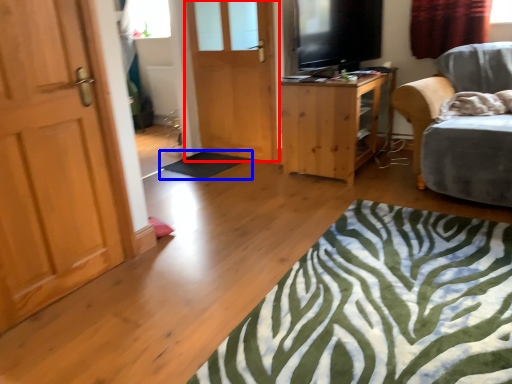
Question: Which object is further to the camera taking this photo, door (highlighted by a red box) or flat (highlighted by a blue box)?

Choices:
 (A) door
 (B) flat

Answer: (B)